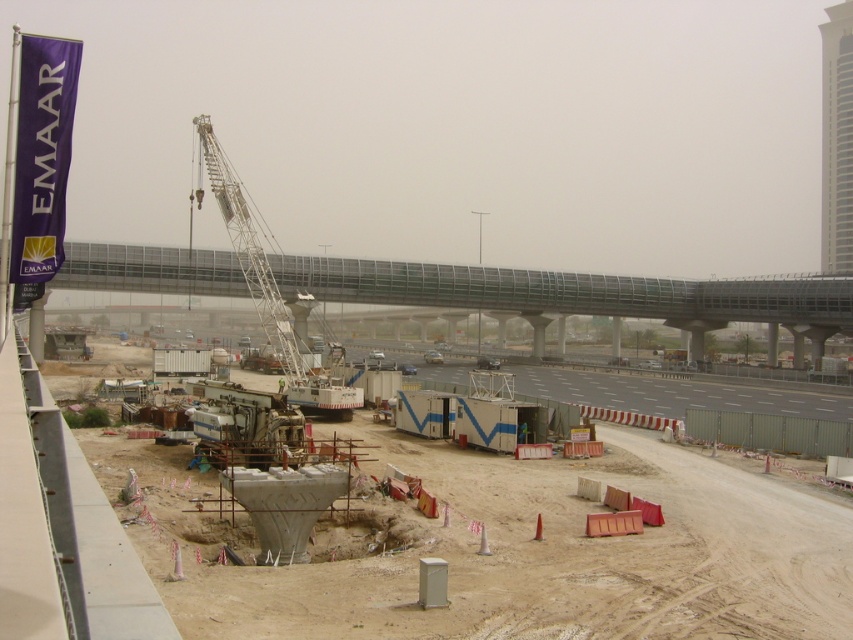
You are a surveyor standing at the construction site. You need to determine which of the two points, point (x=616, y=545) or point (x=531, y=378), is nearer to you. Based on the image, which point is closer?

Point (x=616, y=545) is closer to the viewer than point (x=531, y=378).

You are a delivery truck driver who needs to pass through the construction site. You see the concrete at center and the gray concrete highway at center. Which path is shorter for your truck to take?

The concrete at center is shorter than the gray concrete highway at center, so the truck should take the concrete at center path to save time.

You are a construction worker who needs to install a new light pole that must be 10 meters tall. You are standing near the concrete at center and the metallic gray bridge at center. Which object can you place the pole next to so that it doesn

The concrete at center is not as tall as the metallic gray bridge at center. Therefore, the light pole should be placed next to the metallic gray bridge at center because it is taller and can accommodate the 10 meter pole.